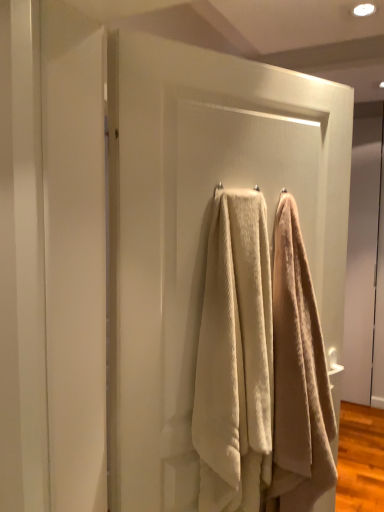
The height and width of the screenshot is (512, 384). What do you see at coordinates (235, 357) in the screenshot?
I see `beige textured towel at center, placed as the 2th towel when sorted from right to left` at bounding box center [235, 357].

Find the location of a particular element. The image size is (384, 512). beige textured towel at center, which is the 1th towel in right-to-left order is located at coordinates (298, 375).

Are white textured towel at center and beige textured towel at center, which is the 1th towel in right-to-left order, located far from each other?

white textured towel at center is actually quite close to beige textured towel at center, which is the 1th towel in right-to-left order.

How distant is white textured towel at center from beige textured towel at center, which is the 1th towel in right-to-left order?

white textured towel at center and beige textured towel at center, which is the 1th towel in right-to-left order, are 8.14 inches apart from each other.

Looking at this image, from the image's perspective, would you say white textured towel at center is shown under beige textured towel at center, the 2th towel from the left?

Actually, white textured towel at center appears above beige textured towel at center, the 2th towel from the left, in the image.

Is white textured towel at center at the left side of beige textured towel at center, which is the 1th towel in right-to-left order?

Yes.

In the scene shown: Is beige textured towel at center, which is the 1th towel in right-to-left order, not near beige textured towel at center, which ranks as the 1th towel in left-to-right order?

beige textured towel at center, which is the 1th towel in right-to-left order, is actually quite close to beige textured towel at center, which ranks as the 1th towel in left-to-right order.

Considering the positions of points (298, 485) and (230, 476), is point (298, 485) closer to camera compared to point (230, 476)?

No, it is not.

Locate an element on the screen. The height and width of the screenshot is (512, 384). towel lying on the right of beige textured towel at center, placed as the 2th towel when sorted from right to left is located at coordinates (298, 375).

Is beige textured towel at center, which ranks as the 1th towel in left-to-right order, touching white textured towel at center?

No.

Considering the sizes of objects beige textured towel at center, placed as the 2th towel when sorted from right to left, and white textured towel at center in the image provided, who is thinner, beige textured towel at center, placed as the 2th towel when sorted from right to left, or white textured towel at center?

white textured towel at center.

How many degrees apart are the facing directions of beige textured towel at center, which ranks as the 1th towel in left-to-right order, and white textured towel at center?

0.00321 degrees separate the facing orientations of beige textured towel at center, which ranks as the 1th towel in left-to-right order, and white textured towel at center.

Is white textured towel at center bigger or smaller than beige textured towel at center, placed as the 2th towel when sorted from right to left?

Result: white textured towel at center is bigger than beige textured towel at center, placed as the 2th towel when sorted from right to left.

Is white textured towel at center oriented away from beige textured towel at center, which ranks as the 1th towel in left-to-right order?

Yes, beige textured towel at center, which ranks as the 1th towel in left-to-right order, is at the back of white textured towel at center.

Locate an element on the screen. Image resolution: width=384 pixels, height=512 pixels. screen door above the beige textured towel at center, which ranks as the 1th towel in left-to-right order (from a real-world perspective) is located at coordinates (205, 230).

From a real-world perspective, is white textured towel at center above or below beige textured towel at center, which ranks as the 1th towel in left-to-right order?

Clearly, from a real-world perspective, white textured towel at center is above beige textured towel at center, which ranks as the 1th towel in left-to-right order.

Based on their sizes in the image, would you say beige textured towel at center, the 2th towel from the left, is bigger or smaller than white textured towel at center?

Clearly, beige textured towel at center, the 2th towel from the left, is smaller in size than white textured towel at center.

Between beige textured towel at center, which is the 1th towel in right-to-left order, and white textured towel at center, which one has larger width?

beige textured towel at center, which is the 1th towel in right-to-left order.

Which is behind, point (288, 347) or point (286, 148)?

The point (286, 148) is more distant.

Considering the relative positions of beige textured towel at center, which is the 1th towel in right-to-left order, and white textured towel at center in the image provided, is beige textured towel at center, which is the 1th towel in right-to-left order, to the left of white textured towel at center from the viewer's perspective?

No, beige textured towel at center, which is the 1th towel in right-to-left order, is not to the left of white textured towel at center.

Is point (271, 343) less distant than point (314, 496)?

Yes, it is.

Is beige textured towel at center, which is the 1th towel in right-to-left order, completely or partially inside beige textured towel at center, which ranks as the 1th towel in left-to-right order?

Actually, beige textured towel at center, which is the 1th towel in right-to-left order, is outside beige textured towel at center, which ranks as the 1th towel in left-to-right order.

Is beige textured towel at center, placed as the 2th towel when sorted from right to left, with beige textured towel at center, the 2th towel from the left?

No, beige textured towel at center, placed as the 2th towel when sorted from right to left, is not making contact with beige textured towel at center, the 2th towel from the left.

From a real-world perspective, is beige textured towel at center, which ranks as the 1th towel in left-to-right order, on beige textured towel at center, the 2th towel from the left?

Yes, from a real-world perspective, beige textured towel at center, which ranks as the 1th towel in left-to-right order, is above beige textured towel at center, the 2th towel from the left.

In order to click on screen door above the beige textured towel at center, the 2th towel from the left (from a real-world perspective) in this screenshot , I will do `click(205, 230)`.

Locate an element on the screen. This screenshot has width=384, height=512. towel in front of the beige textured towel at center, the 2th towel from the left is located at coordinates (235, 357).

Looking at the image, which one is located further to beige textured towel at center, placed as the 2th towel when sorted from right to left, beige textured towel at center, the 2th towel from the left, or white textured towel at center?

white textured towel at center is positioned further to the anchor beige textured towel at center, placed as the 2th towel when sorted from right to left.

Which object lies further to the anchor point beige textured towel at center, which is the 1th towel in right-to-left order, beige textured towel at center, which ranks as the 1th towel in left-to-right order, or white textured towel at center?

white textured towel at center.

Estimate the real-world distances between objects in this image. Which object is further from white textured towel at center, beige textured towel at center, placed as the 2th towel when sorted from right to left, or beige textured towel at center, which is the 1th towel in right-to-left order?

The object further to white textured towel at center is beige textured towel at center, which is the 1th towel in right-to-left order.

From the image, which object appears to be farther from beige textured towel at center, placed as the 2th towel when sorted from right to left, white textured towel at center or beige textured towel at center, the 2th towel from the left?

The object further to beige textured towel at center, placed as the 2th towel when sorted from right to left, is white textured towel at center.

Considering their positions, is white textured towel at center positioned further to beige textured towel at center, which is the 1th towel in right-to-left order, than beige textured towel at center, which ranks as the 1th towel in left-to-right order?

white textured towel at center lies further to beige textured towel at center, which is the 1th towel in right-to-left order, than the other object.

Estimate the real-world distances between objects in this image. Which object is further from white textured towel at center, beige textured towel at center, the 2th towel from the left, or beige textured towel at center, placed as the 2th towel when sorted from right to left?

Among the two, beige textured towel at center, the 2th towel from the left, is located further to white textured towel at center.

The width and height of the screenshot is (384, 512). What are the coordinates of `screen door between beige textured towel at center, placed as the 2th towel when sorted from right to left, and beige textured towel at center, the 2th towel from the left` in the screenshot? It's located at click(205, 230).